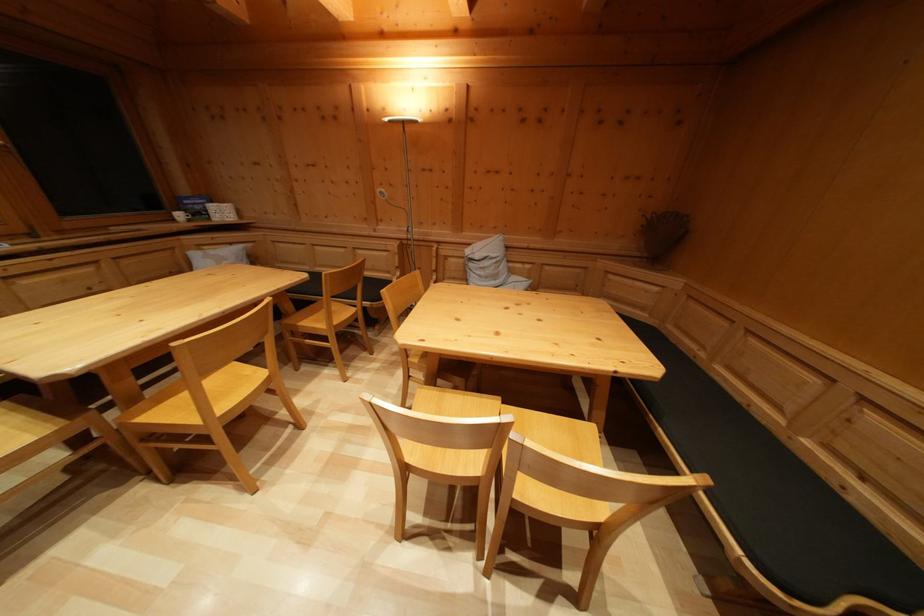
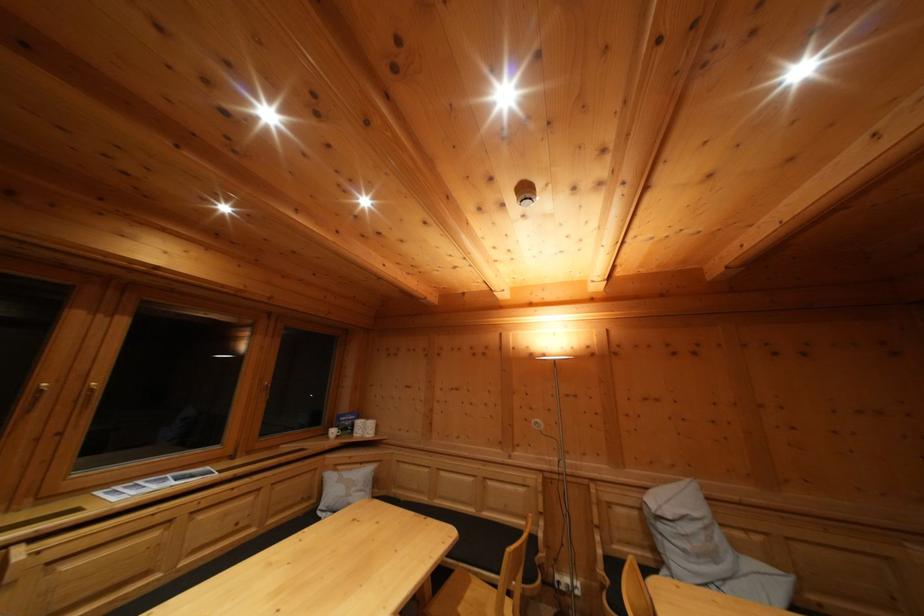
Locate, in the second image, the point that corresponds to [172,209] in the first image.

(332, 426)